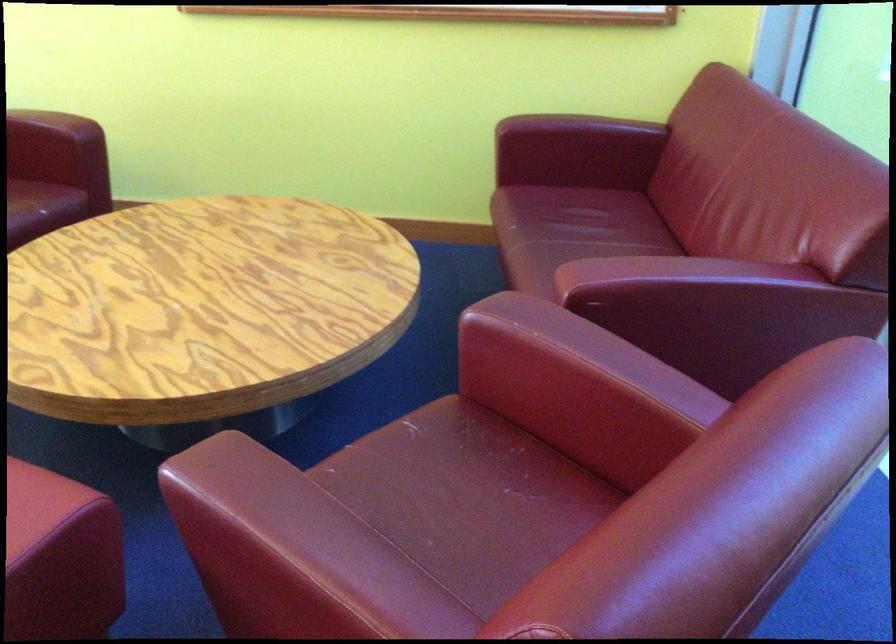
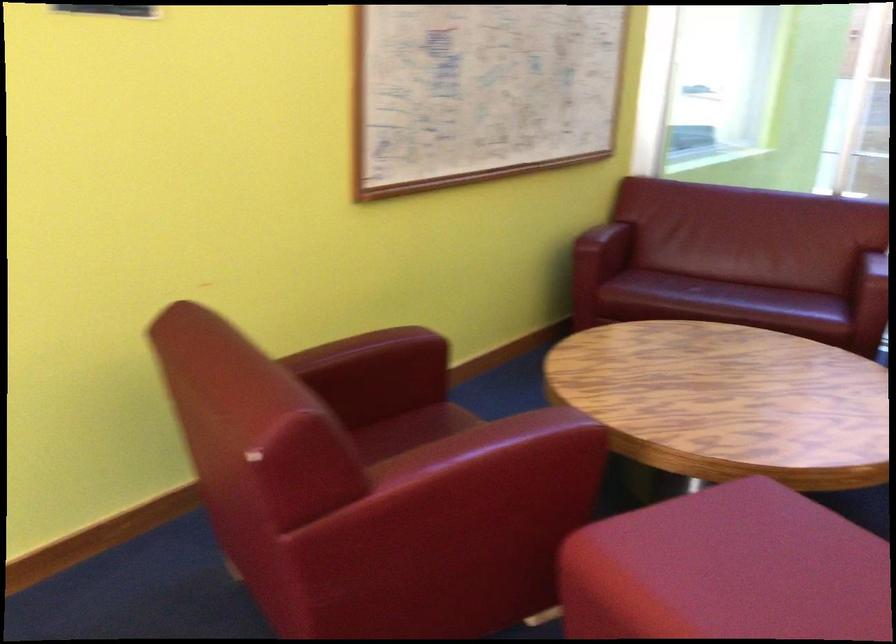
In the second image, find the point that corresponds to (x=505, y=242) in the first image.

(719, 297)